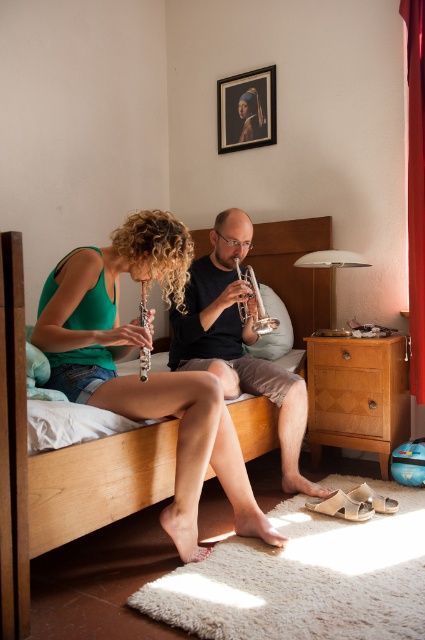
Question: Which point is farther from the camera taking this photo?

Choices:
 (A) (209, 355)
 (B) (300, 310)
 (C) (306, 342)
 (D) (385, 346)

Answer: (B)

Question: Is light brown wood at right positioned before silver metallic trumpet at center?

Choices:
 (A) yes
 (B) no

Answer: (B)

Question: Is matte black trumpet at center above wooden drawer at center right?

Choices:
 (A) no
 (B) yes

Answer: (B)

Question: Which of the following is the closest to the observer?

Choices:
 (A) wooden bed at center
 (B) wooden drawer at center right
 (C) silver metallic trumpet at center

Answer: (A)

Question: Among these objects, which one is farthest from the camera?

Choices:
 (A) silver metallic trumpet at center
 (B) wooden oboe at center

Answer: (A)

Question: Does light brown wood at right have a lesser width compared to wooden drawer at center right?

Choices:
 (A) yes
 (B) no

Answer: (B)